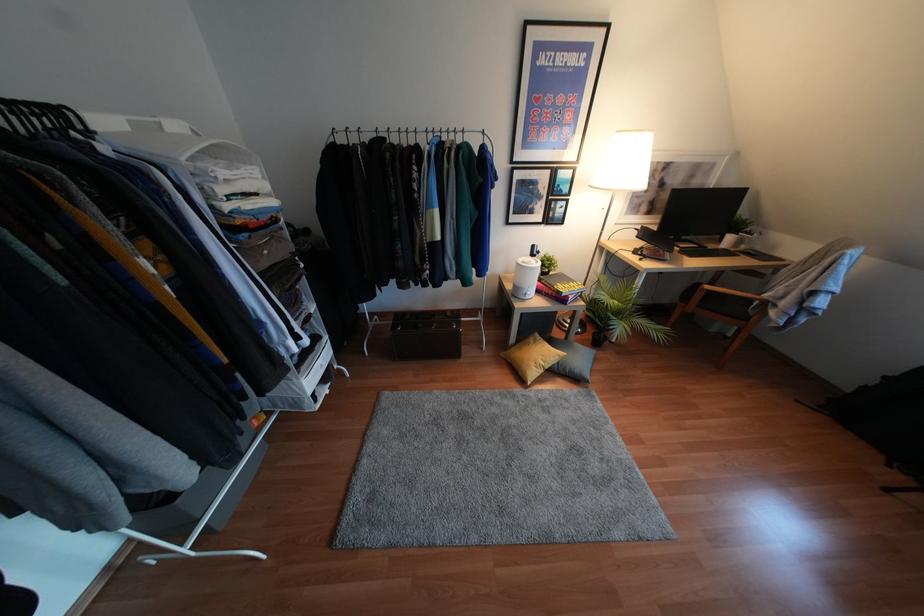
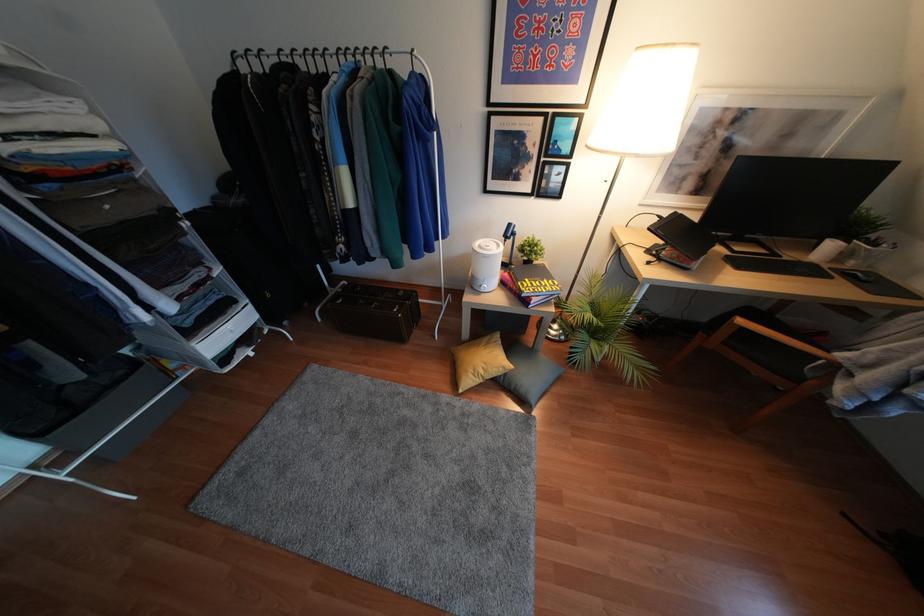
Where in the second image is the point corresponding to pixel 541 363 from the first image?

(480, 371)